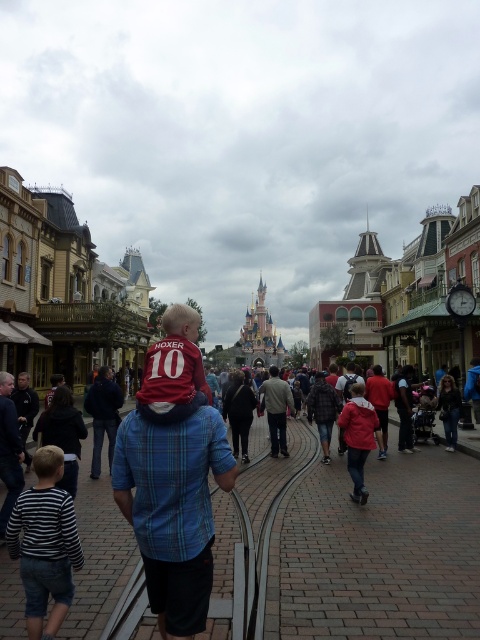
Question: Among these points, which one is nearest to the camera?

Choices:
 (A) (260, 432)
 (B) (34, 468)

Answer: (B)

Question: Is matte red shirt at center positioned behind striped cotton shirt at lower left?

Choices:
 (A) no
 (B) yes

Answer: (B)

Question: Among these objects, which one is nearest to the camera?

Choices:
 (A) matte red shirt at center
 (B) striped cotton shirt at lower left

Answer: (B)

Question: Among these objects, which one is nearest to the camera?

Choices:
 (A) striped cotton shirt at lower left
 (B) matte red shirt at center

Answer: (A)

Question: Observing the image, what is the correct spatial positioning of matte red shirt at center in reference to striped cotton shirt at lower left?

Choices:
 (A) below
 (B) above

Answer: (A)

Question: Where is matte red shirt at center located in relation to striped cotton shirt at lower left in the image?

Choices:
 (A) right
 (B) left

Answer: (A)